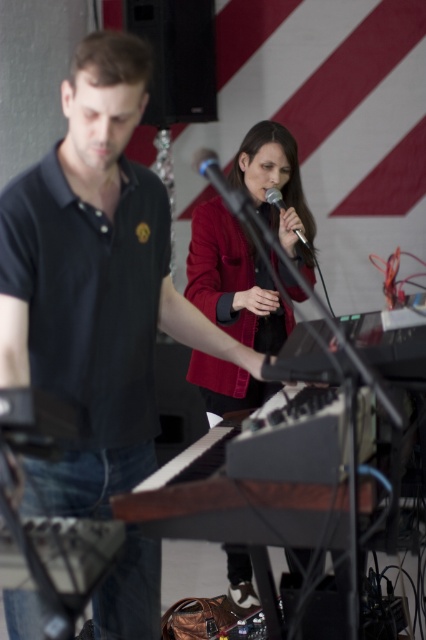
You are a photographer at the live music performance. You want to ensure both the black matte shirt at left and the silver metallic microphone at center are clearly visible in your photo. Which object should you focus on first to ensure it doesn t get too small in the frame?

The silver metallic microphone at center should be focused on first because the black matte shirt at left is bigger than the silver metallic microphone at center, so the smaller object might need more attention to remain visible.

You are a stagehand standing at the center of the stage. You need to move the microphone stand to the location of the matte red jacket at center. What are the coordinates you should aim for?

The coordinates for the matte red jacket at center are point (233, 280). So move the microphone stand to point (233, 280).

You are a photographer setting up for a live performance. You need to ensure that the black matte shirt at left and the silver metallic microphone at center are both visible in your shot. Based on their sizes, which object will appear larger in the photo?

The black matte shirt at left appears larger in the photo because it has a greater height compared to the silver metallic microphone at center.